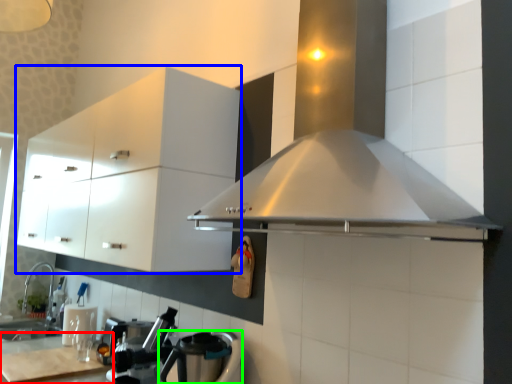
Question: Considering the real-world distances, which object is closest to counter top (highlighted by a red box)? cabinetry (highlighted by a blue box) or kitchen appliance (highlighted by a green box).

Choices:
 (A) cabinetry
 (B) kitchen appliance

Answer: (B)